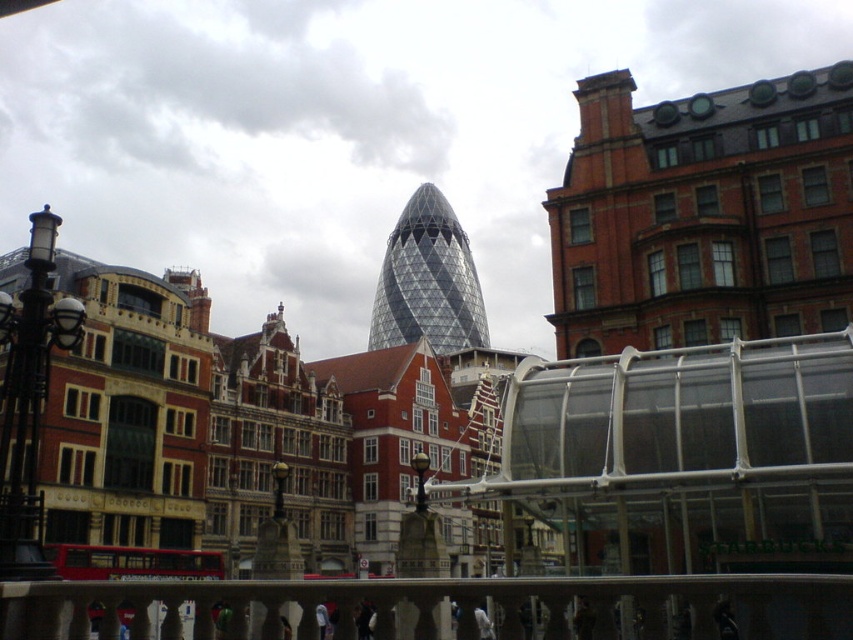
You are standing at the entrance of the Starbucks in the foreground and want to reach the historic buildings on the left. Which direction should you walk relative to the white marble railing at center?

To reach the historic buildings on the left, you should walk to the left of the white marble railing at center since the railing is centrally located and the historic buildings are on the left side of the scene.

You are a city planner assessing the space between the white marble railing at center and the transparent glass tower at center. Which structure takes up more area in the scene?

The transparent glass tower at center occupies more space than the white marble railing at center, so it takes up more area in the scene.